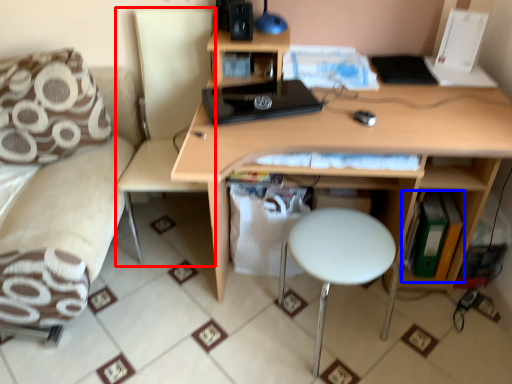
Question: Which of the following is the farthest to the observer, swivel chair (highlighted by a red box) or book (highlighted by a blue box)?

Choices:
 (A) swivel chair
 (B) book

Answer: (B)